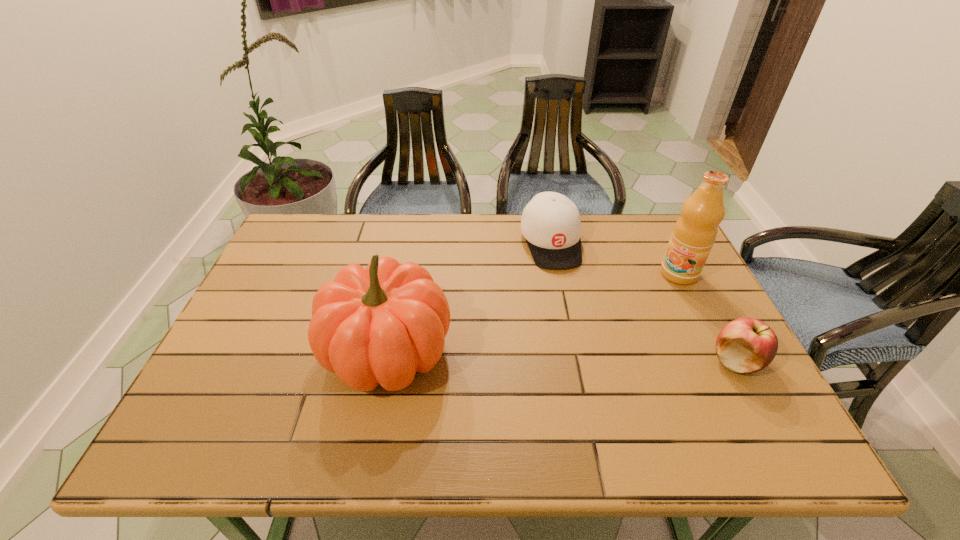
Where is `the leftmost object`? the leftmost object is located at coordinates (380, 325).

Find the location of a particular element. apple is located at coordinates (745, 345).

Identify the location of baseball cap. The width and height of the screenshot is (960, 540). (551, 225).

This screenshot has height=540, width=960. In order to click on fruit juice in this screenshot , I will do `click(695, 232)`.

I want to click on vacant space situated 0.170m on the left of the pumpkin, so click(253, 352).

Where is `free location located 0.300m on the bitten side of the apple`? The height and width of the screenshot is (540, 960). free location located 0.300m on the bitten side of the apple is located at coordinates (585, 361).

I want to click on free spot located on the bitten side of the apple, so click(x=597, y=361).

This screenshot has width=960, height=540. In order to click on vacant region located 0.390m on the bitten side of the apple in this screenshot , I will do `click(547, 361)`.

The image size is (960, 540). I want to click on vacant region located 0.140m on the front-facing side of the baseball cap, so click(x=571, y=306).

Locate an element on the screen. The width and height of the screenshot is (960, 540). vacant region located on the front-facing side of the baseball cap is located at coordinates (592, 363).